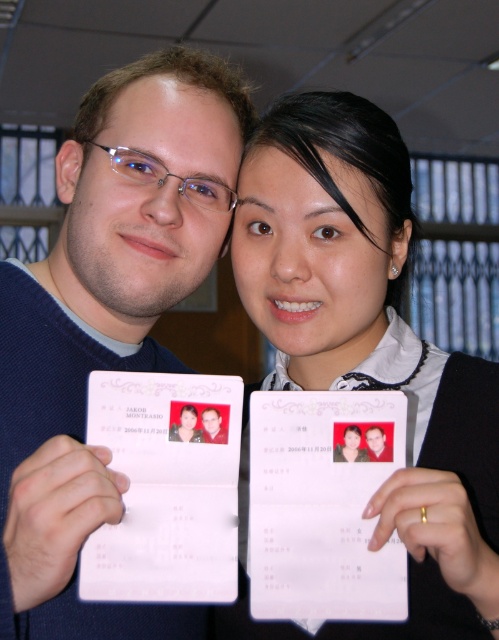
You are an office security guard who needs to verify the ID of the person wearing the matte blue sweater at center. The ID card must be clearly visible to scan. Can you tell if the matte white id card at center is large enough to be scanned properly?

The matte blue sweater at center is larger in size than the matte white id card at center. Since the ID card is smaller than the sweater, it might not be large enough to scan properly. Please ask the individual to present a larger ID card or zoom in for a clearer scan.

You are standing in an office and see the matte blue sweater at center and the white paper at center. Which object is nearer to you?

The matte blue sweater at center is closer to the viewer than the white paper at center.